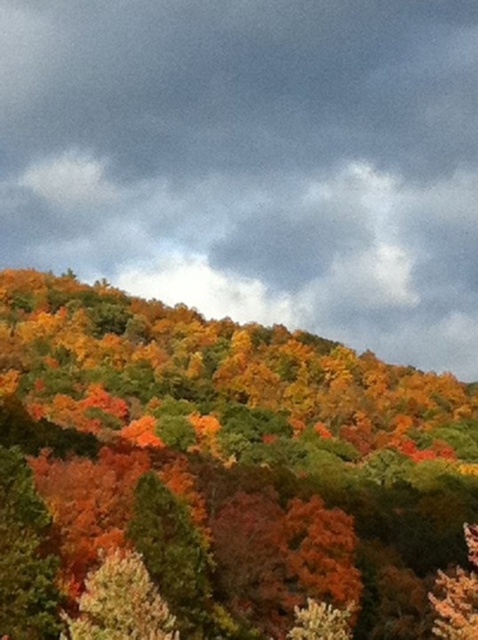
Question: Which point appears farthest from the camera in this image?

Choices:
 (A) (343, 374)
 (B) (313, 44)

Answer: (B)

Question: Does cloudy gray sky at upper center appear over multicolored foliage at center?

Choices:
 (A) no
 (B) yes

Answer: (B)

Question: Among these objects, which one is nearest to the camera?

Choices:
 (A) cloudy gray sky at upper center
 (B) multicolored foliage at center

Answer: (B)

Question: Considering the relative positions of cloudy gray sky at upper center and multicolored foliage at center in the image provided, where is cloudy gray sky at upper center located with respect to multicolored foliage at center?

Choices:
 (A) above
 (B) below

Answer: (A)

Question: Which point is closer to the camera?

Choices:
 (A) (130, 83)
 (B) (351, 461)

Answer: (B)

Question: Where is cloudy gray sky at upper center located in relation to multicolored foliage at center in the image?

Choices:
 (A) above
 (B) below

Answer: (A)